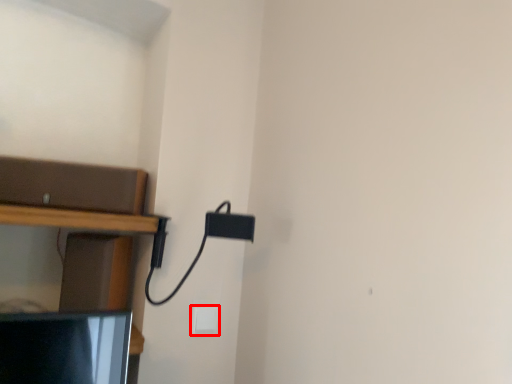
Question: In this image, where is light switch (annotated by the red box) located relative to shelf?

Choices:
 (A) left
 (B) right

Answer: (B)